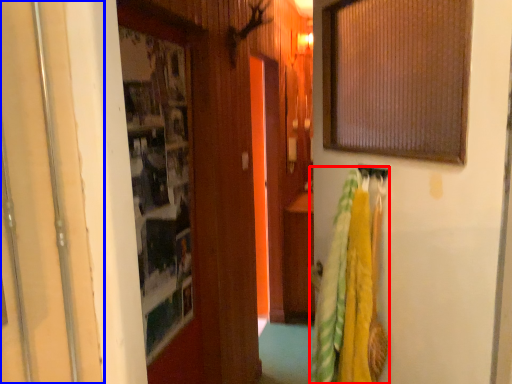
Question: Which object appears farthest to the camera in this image, laundry (highlighted by a red box) or door (highlighted by a blue box)?

Choices:
 (A) laundry
 (B) door

Answer: (A)